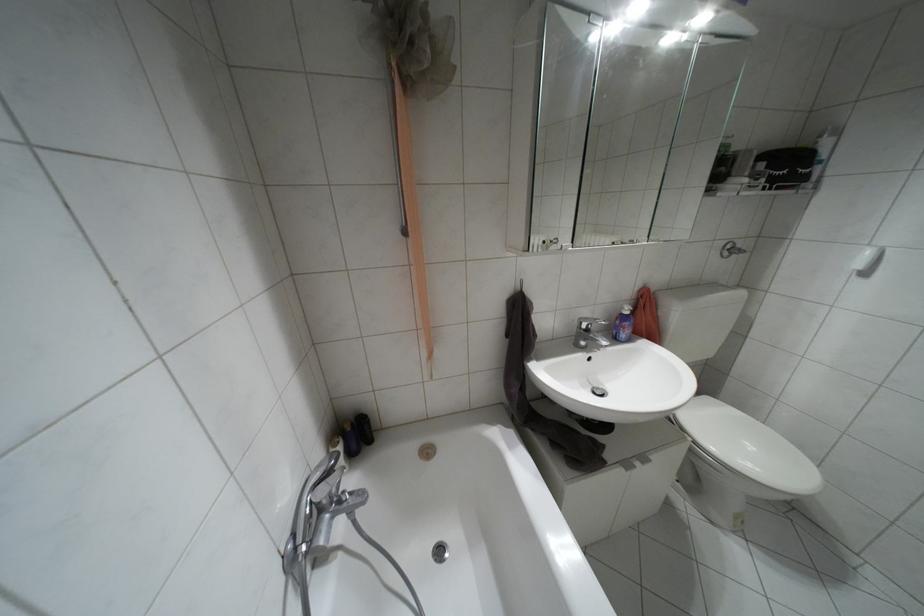
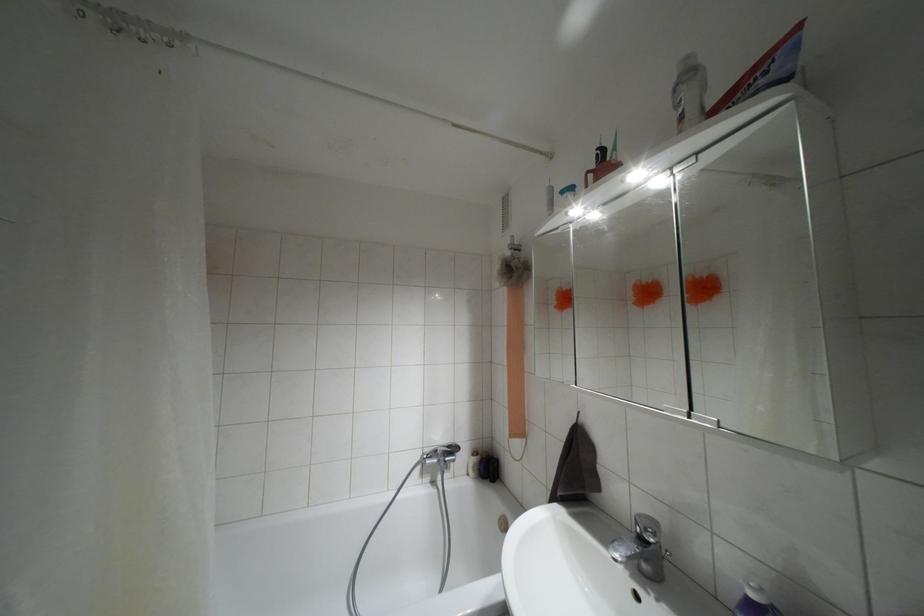
In the second image, find the point that corresponds to the point at 587,330 in the first image.

(641, 538)